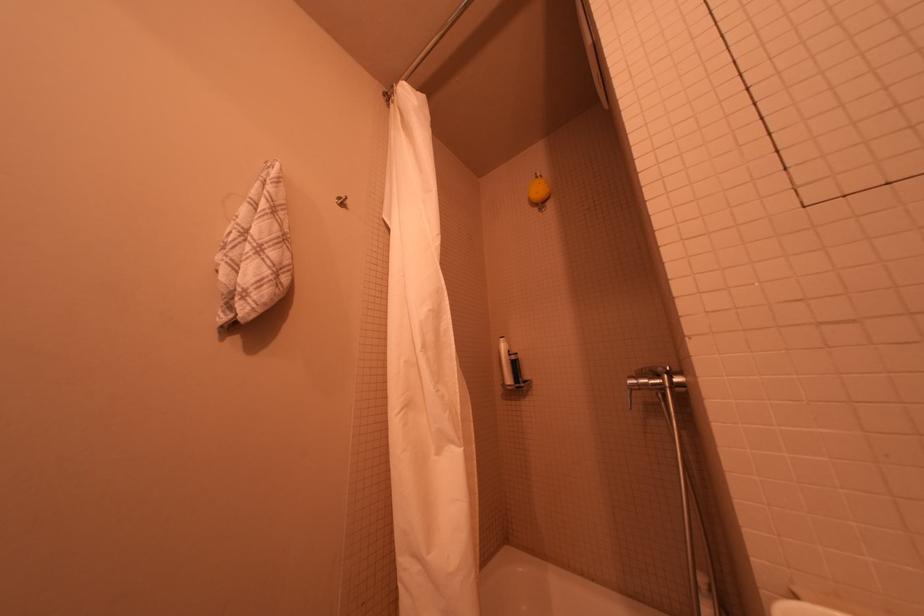
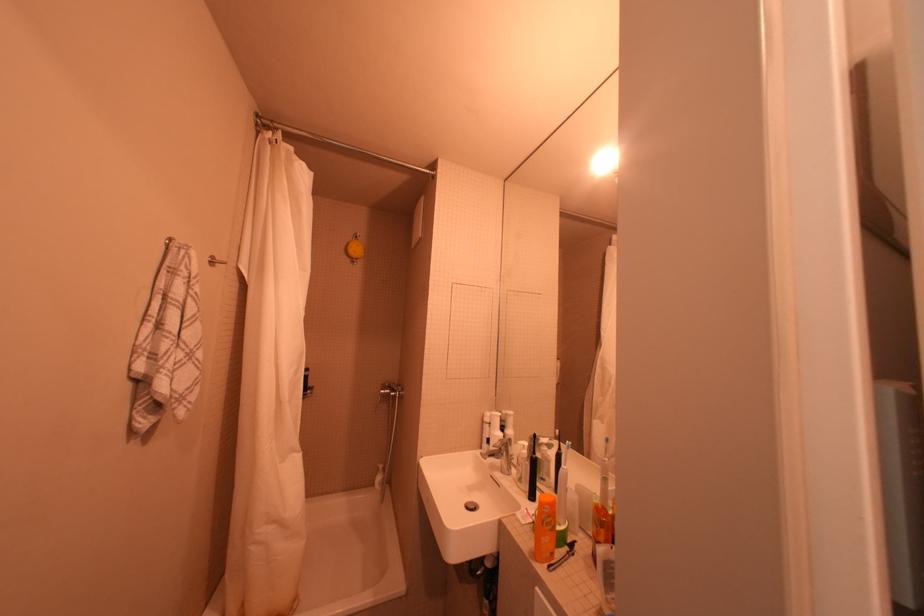
Where in the second image is the point corresponding to (424,569) from the first image?

(281, 528)